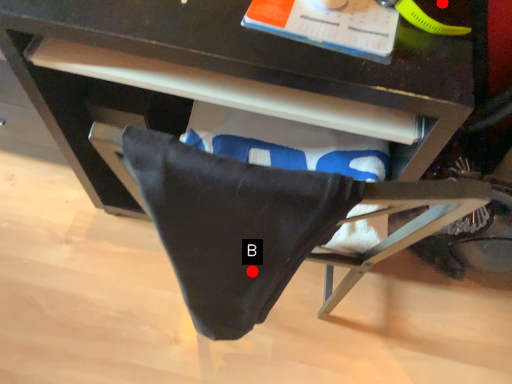
Question: Two points are circled on the image, labeled by A and B beside each circle. Among these points, which one is nearest to the camera?

Choices:
 (A) A is closer
 (B) B is closer

Answer: (B)